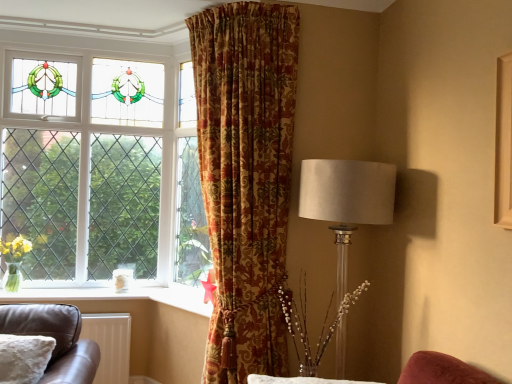
Image resolution: width=512 pixels, height=384 pixels. I want to click on white matte radiator at lower left, so click(110, 344).

What do you see at coordinates (346, 200) in the screenshot? I see `satin white lampshade at right` at bounding box center [346, 200].

Based on the photo, measure the distance between point [371,208] and camera.

Point [371,208] and camera are 6.87 feet apart from each other.

The height and width of the screenshot is (384, 512). In order to click on white fluffy pillow at lower left in this screenshot , I will do `click(24, 358)`.

Between gold-patterned curtain at center and white matte radiator at lower left, which one is positioned in front?

gold-patterned curtain at center is closer to the camera.

Considering the relative sizes of gold-patterned curtain at center and white matte radiator at lower left in the image provided, is gold-patterned curtain at center bigger than white matte radiator at lower left?

Yes, gold-patterned curtain at center is bigger than white matte radiator at lower left.

From a real-world perspective, is gold-patterned curtain at center on top of white matte radiator at lower left?

Yes.

Is gold-patterned curtain at center aimed at white matte radiator at lower left?

No, gold-patterned curtain at center does not turn towards white matte radiator at lower left.

Locate an element on the screen. This screenshot has width=512, height=384. window lying above the white matte radiator at lower left (from the image's perspective) is located at coordinates (102, 167).

Can you confirm if clear glass window at upper left is smaller than white matte radiator at lower left?

No.

Measure the distance between clear glass window at upper left and white matte radiator at lower left.

clear glass window at upper left is 34.71 inches from white matte radiator at lower left.

Which of these two, clear glass window at upper left or white matte radiator at lower left, stands shorter?

Standing shorter between the two is white matte radiator at lower left.

Looking at their sizes, would you say white matte radiator at lower left is wider or thinner than translucent glass vase at center, placed as the 1th floral arrangement when sorted from right to left?

white matte radiator at lower left is thinner than translucent glass vase at center, placed as the 1th floral arrangement when sorted from right to left.

Is the depth of white matte radiator at lower left less than that of translucent glass vase at center, the first floral arrangement from the front?

No, the depth of white matte radiator at lower left is greater than that of translucent glass vase at center, the first floral arrangement from the front.

Considering the points (101, 379) and (334, 329), which point is behind, point (101, 379) or point (334, 329)?

Positioned behind is point (101, 379).

Consider the image. Between white matte radiator at lower left and translucent glass vase at center, placed as the 1th floral arrangement when sorted from right to left, which one has smaller size?

white matte radiator at lower left is smaller.

Between clear glass window at upper left and gold-patterned curtain at center, which one is positioned behind?

clear glass window at upper left is behind.

From the image's perspective, is clear glass window at upper left above gold-patterned curtain at center?

Yes, from the image's perspective, clear glass window at upper left is over gold-patterned curtain at center.

Which is correct: clear glass window at upper left is inside gold-patterned curtain at center, or outside of it?

clear glass window at upper left is outside gold-patterned curtain at center.

Is clear glass window at upper left taller or shorter than gold-patterned curtain at center?

clear glass window at upper left is shorter than gold-patterned curtain at center.

Is translucent glass vase with yellow flowers at left, the first floral arrangement positioned from the left, wider than clear glass window at upper left?

Indeed, translucent glass vase with yellow flowers at left, the first floral arrangement positioned from the left, has a greater width compared to clear glass window at upper left.

Is translucent glass vase with yellow flowers at left, the first floral arrangement positioned from the left, spatially inside clear glass window at upper left, or outside of it?

translucent glass vase with yellow flowers at left, the first floral arrangement positioned from the left, lies within the bounds of clear glass window at upper left.

Relative to clear glass window at upper left, is translucent glass vase with yellow flowers at left, which is the 2th floral arrangement from right to left, in front or behind?

In the image, translucent glass vase with yellow flowers at left, which is the 2th floral arrangement from right to left, appears in front of clear glass window at upper left.

Is clear glass window at upper left positioned with its back to translucent glass vase with yellow flowers at left, marked as the second floral arrangement in a front-to-back arrangement?

Yes.

Is the surface of clear glass window at upper left in direct contact with translucent glass vase with yellow flowers at left, which is the 2th floral arrangement from right to left?

clear glass window at upper left and translucent glass vase with yellow flowers at left, which is the 2th floral arrangement from right to left, are not in contact.

Does clear glass window at upper left have a greater height compared to translucent glass vase with yellow flowers at left, which is the 2th floral arrangement from right to left?

Indeed, clear glass window at upper left has a greater height compared to translucent glass vase with yellow flowers at left, which is the 2th floral arrangement from right to left.

Does point (10, 368) appear closer or farther from the camera than point (25, 239)?

Point (10, 368) is closer to the camera than point (25, 239).

Is translucent glass vase with yellow flowers at left, which is the 2th floral arrangement from right to left, a part of white fluffy pillow at lower left?

No, translucent glass vase with yellow flowers at left, which is the 2th floral arrangement from right to left, is located outside of white fluffy pillow at lower left.

Considering the sizes of objects white fluffy pillow at lower left and translucent glass vase with yellow flowers at left, which is the 2th floral arrangement from right to left, in the image provided, who is taller, white fluffy pillow at lower left or translucent glass vase with yellow flowers at left, which is the 2th floral arrangement from right to left,?

A: translucent glass vase with yellow flowers at left, which is the 2th floral arrangement from right to left.

Who is more distant, white fluffy pillow at lower left or translucent glass vase with yellow flowers at left, which is the 2th floral arrangement from right to left?

translucent glass vase with yellow flowers at left, which is the 2th floral arrangement from right to left, is behind.

This screenshot has height=384, width=512. Find the location of `radiator on the left side of gold-patterned curtain at center`. radiator on the left side of gold-patterned curtain at center is located at coordinates (110, 344).

The width and height of the screenshot is (512, 384). I want to click on radiator below the clear glass window at upper left (from a real-world perspective), so click(110, 344).

When comparing their distances from translucent glass vase at center, which appears as the second floral arrangement when viewed from the left, does satin white lampshade at right or gold-patterned curtain at center seem closer?

Among the two, gold-patterned curtain at center is located nearer to translucent glass vase at center, which appears as the second floral arrangement when viewed from the left.

Considering their positions, is translucent glass vase with yellow flowers at left, the first floral arrangement positioned from the left, positioned closer to white fluffy pillow at lower left than gold-patterned curtain at center?

translucent glass vase with yellow flowers at left, the first floral arrangement positioned from the left, is closer to white fluffy pillow at lower left.

In the scene shown: Estimate the real-world distances between objects in this image. Which object is further from satin white lampshade at right, translucent glass vase with yellow flowers at left, marked as the second floral arrangement in a front-to-back arrangement, or white fluffy pillow at lower left?

Based on the image, translucent glass vase with yellow flowers at left, marked as the second floral arrangement in a front-to-back arrangement, appears to be further to satin white lampshade at right.

Based on their spatial positions, is clear glass window at upper left or satin white lampshade at right closer to white matte radiator at lower left?

clear glass window at upper left lies closer to white matte radiator at lower left than the other object.

Which object lies further to the anchor point satin white lampshade at right, white matte radiator at lower left or translucent glass vase with yellow flowers at left, which is the 2th floral arrangement from right to left?

The object further to satin white lampshade at right is translucent glass vase with yellow flowers at left, which is the 2th floral arrangement from right to left.

Which object lies further to the anchor point satin white lampshade at right, white matte radiator at lower left or clear glass window at upper left?

The object further to satin white lampshade at right is white matte radiator at lower left.

Looking at this image, considering their positions, is translucent glass vase at center, placed as the 1th floral arrangement when sorted from right to left, positioned closer to satin white lampshade at right than white fluffy pillow at lower left?

Based on the image, translucent glass vase at center, placed as the 1th floral arrangement when sorted from right to left, appears to be nearer to satin white lampshade at right.

Estimate the real-world distances between objects in this image. Which object is closer to gold-patterned curtain at center, white fluffy pillow at lower left or satin white lampshade at right?

satin white lampshade at right.

You are a GUI agent. You are given a task and a screenshot of the screen. Output one action in this format:
    pyautogui.click(x=<x>, y=<y>)
    Task: Click on the curtain located between translucent glass vase with yellow flowers at left, marked as the second floral arrangement in a front-to-back arrangement, and satin white lampshade at right in the left-right direction
    This screenshot has height=384, width=512.
    Given the screenshot: What is the action you would take?
    pyautogui.click(x=246, y=177)

You are a GUI agent. You are given a task and a screenshot of the screen. Output one action in this format:
    pyautogui.click(x=<x>, y=<y>)
    Task: Click on the radiator between white fluffy pillow at lower left and translucent glass vase with yellow flowers at left, marked as the second floral arrangement in a front-to-back arrangement, from front to back
    Image resolution: width=512 pixels, height=384 pixels.
    Given the screenshot: What is the action you would take?
    pyautogui.click(x=110, y=344)

This screenshot has height=384, width=512. In order to click on pillow between translucent glass vase with yellow flowers at left, arranged as the 1th floral arrangement when viewed from the back, and translucent glass vase at center, placed as the 1th floral arrangement when sorted from right to left, from left to right in this screenshot , I will do `click(24, 358)`.

The height and width of the screenshot is (384, 512). I want to click on pillow between clear glass window at upper left and satin white lampshade at right from left to right, so click(x=24, y=358).